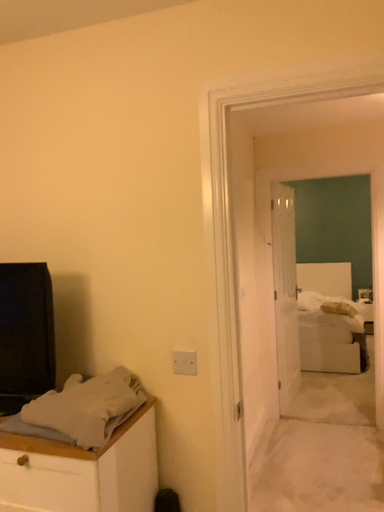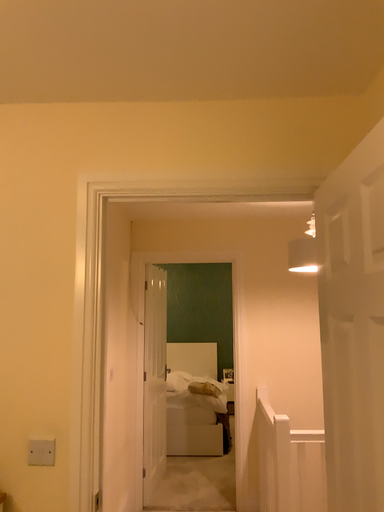
Question: How did the camera likely rotate when shooting the video?

Choices:
 (A) rotated right
 (B) rotated left

Answer: (A)